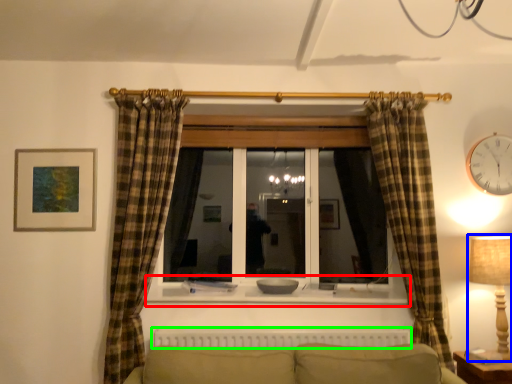
Question: Which object is positioned farthest from window sill (highlighted by a red box)? Select from table lamp (highlighted by a blue box) and radiator (highlighted by a green box).

Choices:
 (A) table lamp
 (B) radiator

Answer: (A)